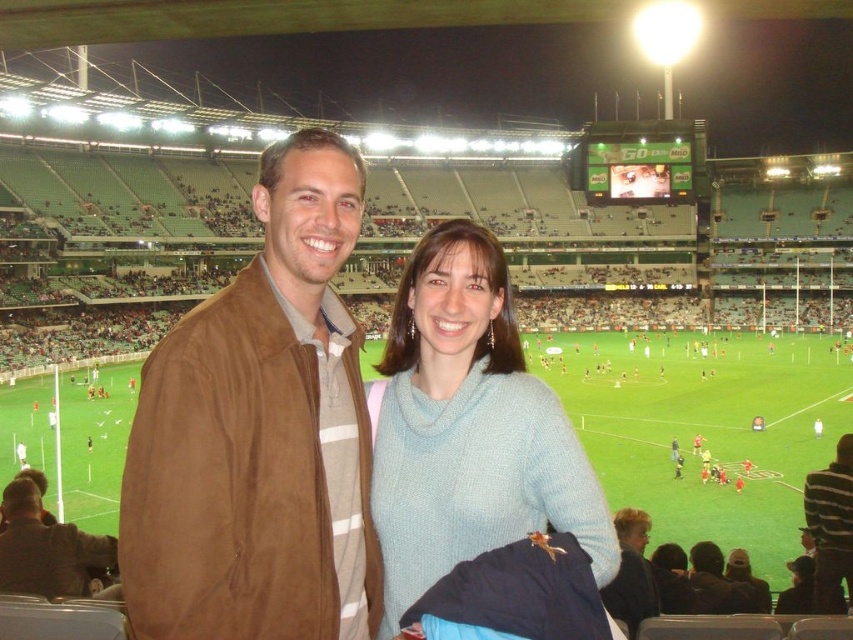
You are a photographer at the stadium and want to take a photo of the brown leather jacket at lower left and the striped sweater at center. Which object should you zoom in on to make them appear the same size in the photo?

The brown leather jacket at lower left is not as tall as striped sweater at center, so you should zoom in on the striped sweater at center to make them appear the same size in the photo.

You are a photographer standing at the center of the stadium, aiming to capture a closeup shot of both the brown leather jacket at lower left and the striped sweater at center. Given that your camera has a maximum zoom range of 40 meters, will you be able to focus on both subjects simultaneously?

The distance between the brown leather jacket at lower left and the striped sweater at center is 44.07 meters, which exceeds the camera maximum zoom range of 40 meters. Therefore, you cannot focus on both subjects simultaneously.